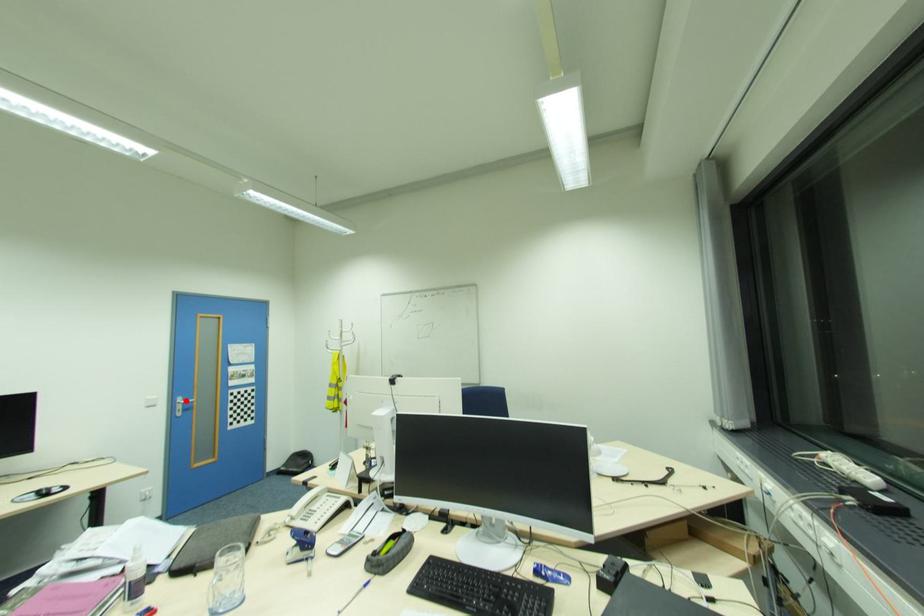
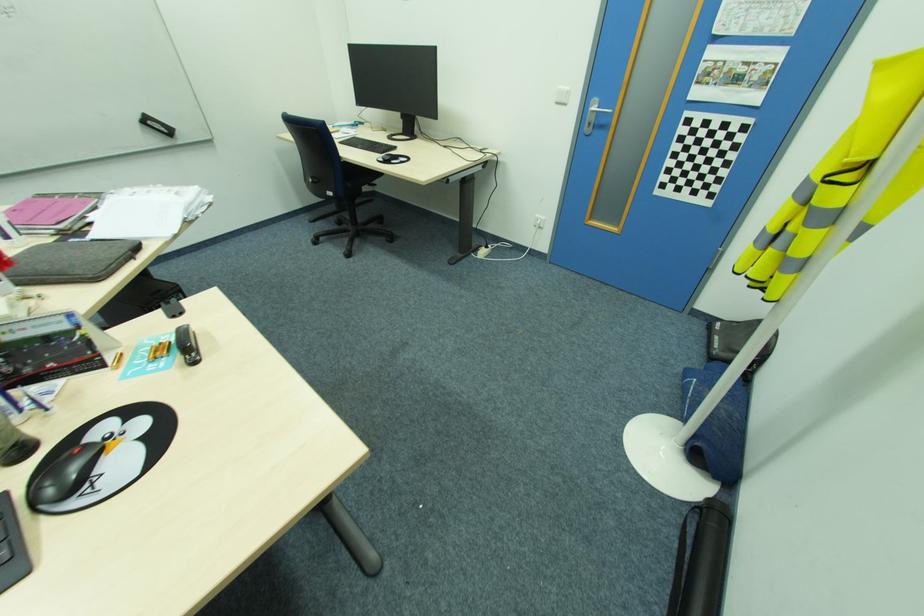
Locate, in the second image, the point that corresponds to the highlighted location in the first image.

(600, 108)